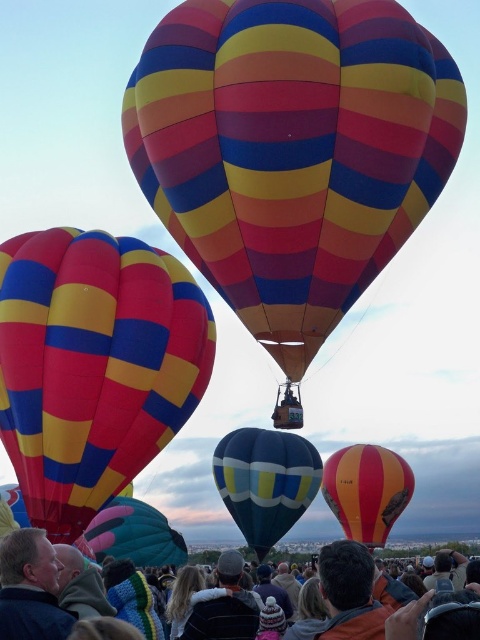
You are a photographer at the hot air balloon festival. You want to capture a photo that includes both the matte striped balloon at left and the dark blue knit hat at center. Since the balloon is smaller in the frame, where should you position your camera to ensure both objects are clearly visible?

To ensure both the matte striped balloon at left and the dark blue knit hat at center are clearly visible, position your camera closer to the matte striped balloon at left. This will balance their sizes in the frame, as the balloon is smaller compared to the hat.

You are a photographer trying to capture a photo of the blue glossy balloon at center and the smooth beige jacket at lower left. Since you want both subjects to be in focus, you need to know which one is taller. Can you tell me which object is taller?

The blue glossy balloon at center is taller than the smooth beige jacket at lower left according to the description.

You are a photographer at the hot air balloon festival and want to capture the crowd in the foreground. Where exactly is the multicolored fabric crowd at lower center located in the image?

The multicolored fabric crowd at lower center is located at point (24,580).